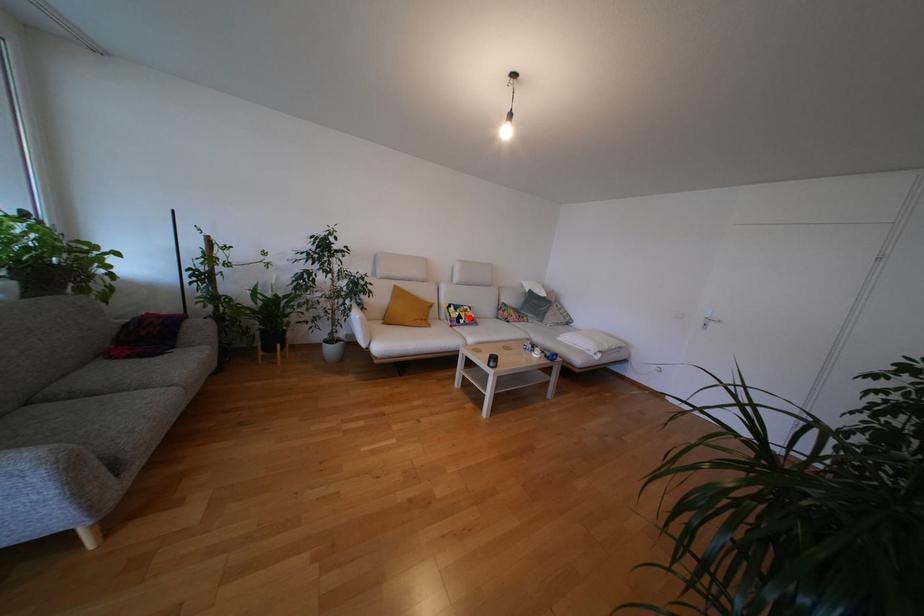
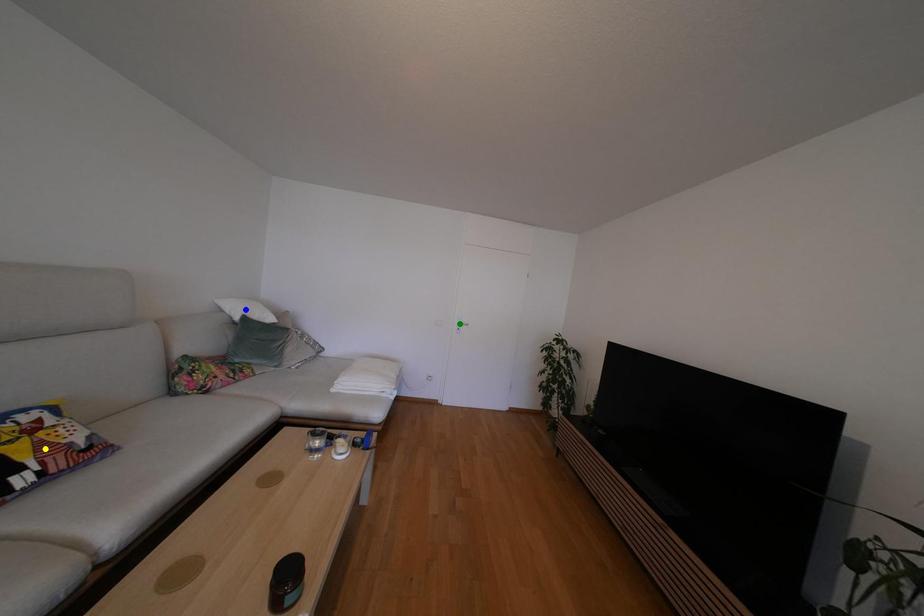
Question: I am providing you with two images of the same scene from different viewpoints. A red point is marked on the first image. You are given multiple points on the second image. Which spot in image 2 lines up with the point in image 1?

Choices:
 (A) green point
 (B) yellow point
 (C) blue point

Answer: (B)